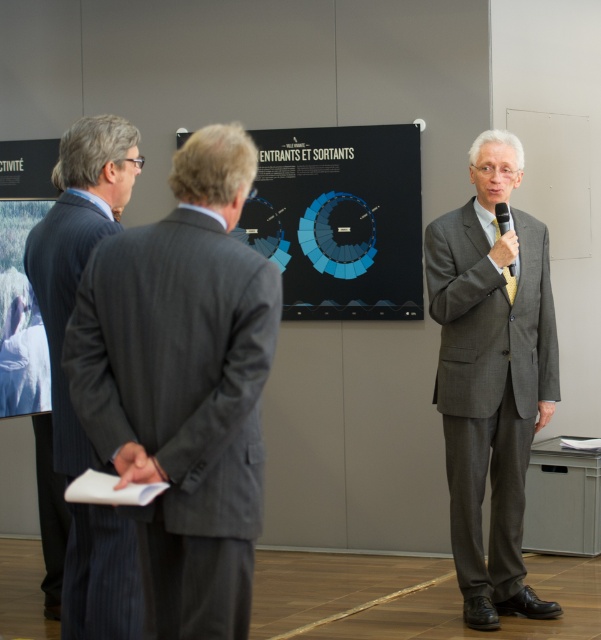
Question: Among these points, which one is nearest to the camera?

Choices:
 (A) (528, 308)
 (B) (293, 246)

Answer: (A)

Question: Does gray pinstripe suit at left have a greater width compared to gray suit at center?

Choices:
 (A) yes
 (B) no

Answer: (B)

Question: Based on their relative distances, which object is farther from the gray suit at center?

Choices:
 (A) gray pinstripe suit at left
 (B) black matte projection screen at center

Answer: (A)

Question: Which object is closer to the camera taking this photo?

Choices:
 (A) pinstriped wool suit at left
 (B) gray pinstripe suit at left
 (C) gray suit at center
 (D) black matte projection screen at center

Answer: (B)

Question: Does gray pinstripe suit at left have a greater width compared to black matte projection screen at center?

Choices:
 (A) no
 (B) yes

Answer: (A)

Question: Can you confirm if gray pinstripe suit at left is bigger than black matte projection screen at center?

Choices:
 (A) yes
 (B) no

Answer: (B)